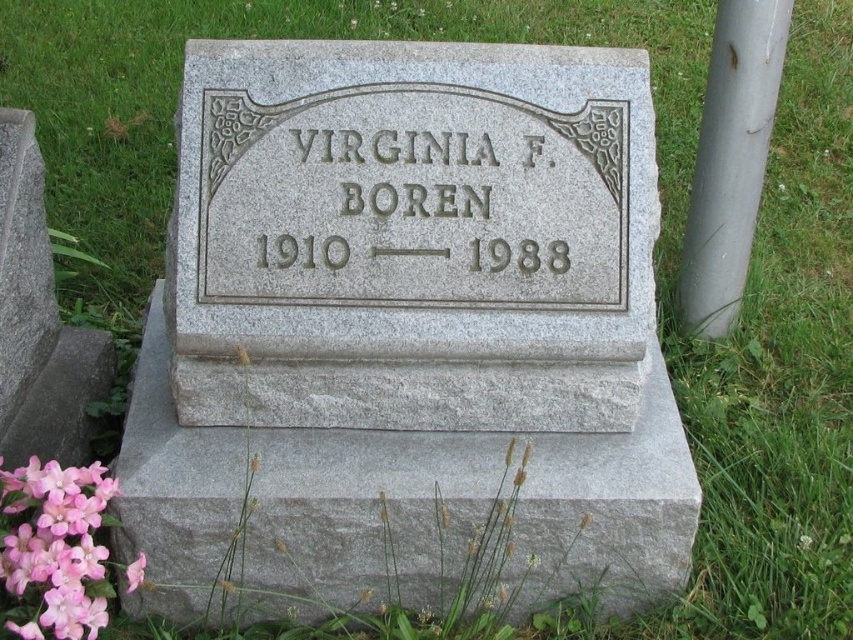
Question: Which of the following is the farthest from the observer?

Choices:
 (A) pink matte flower at lower left
 (B) gray metallic pole at right
 (C) gray granite inscription at center

Answer: (B)

Question: Which of the following is the closest to the observer?

Choices:
 (A) gray granite inscription at center
 (B) pink matte flower at lower left

Answer: (B)

Question: Can you confirm if gray metallic pole at right is bigger than pink matte flower at lower left?

Choices:
 (A) yes
 (B) no

Answer: (A)

Question: Estimate the real-world distances between objects in this image. Which object is farther from the gray metallic pole at right?

Choices:
 (A) gray granite inscription at center
 (B) pink matte flower at lower left

Answer: (B)

Question: Is gray granite inscription at center in front of gray metallic pole at right?

Choices:
 (A) yes
 (B) no

Answer: (A)

Question: In this image, where is gray metallic pole at right located relative to pink matte flower at lower left?

Choices:
 (A) left
 (B) right

Answer: (B)